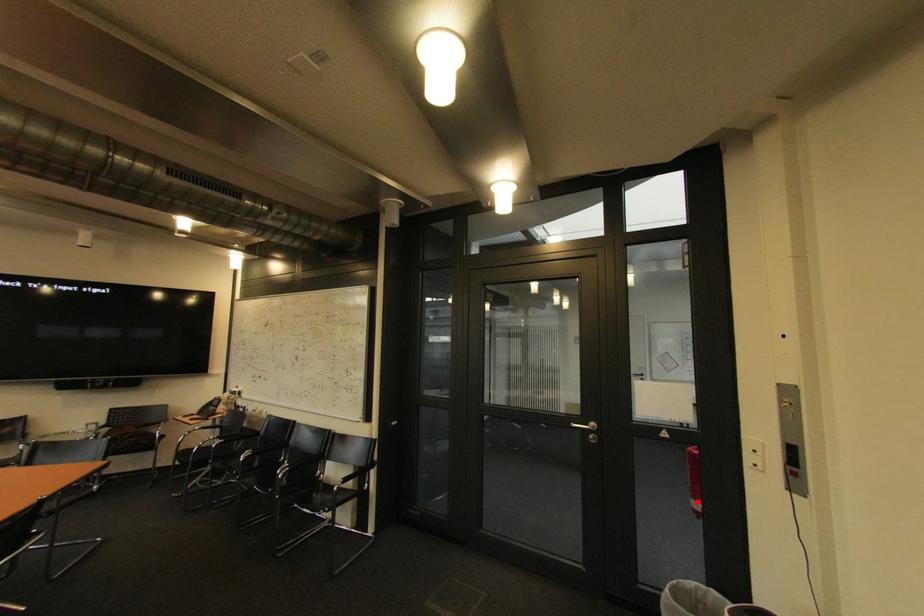
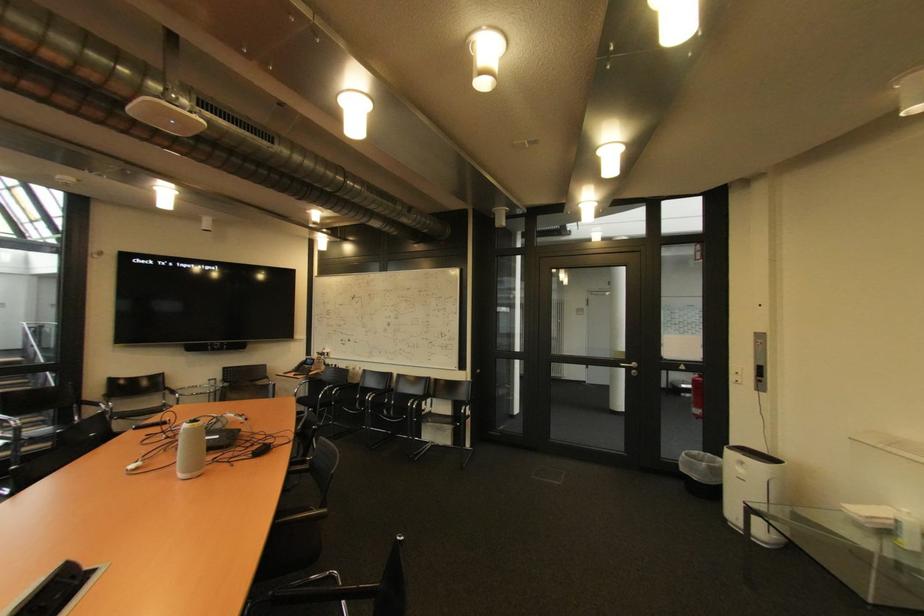
In the second image, find the point that corresponds to the highlighted location in the first image.

(699, 411)